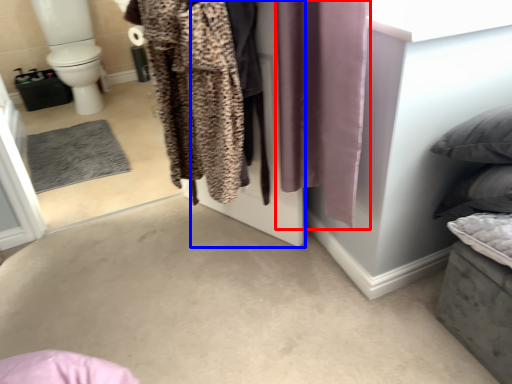
Question: Which of the following is the closest to the observer, curtain (highlighted by a red box) or screen door (highlighted by a blue box)?

Choices:
 (A) curtain
 (B) screen door

Answer: (A)